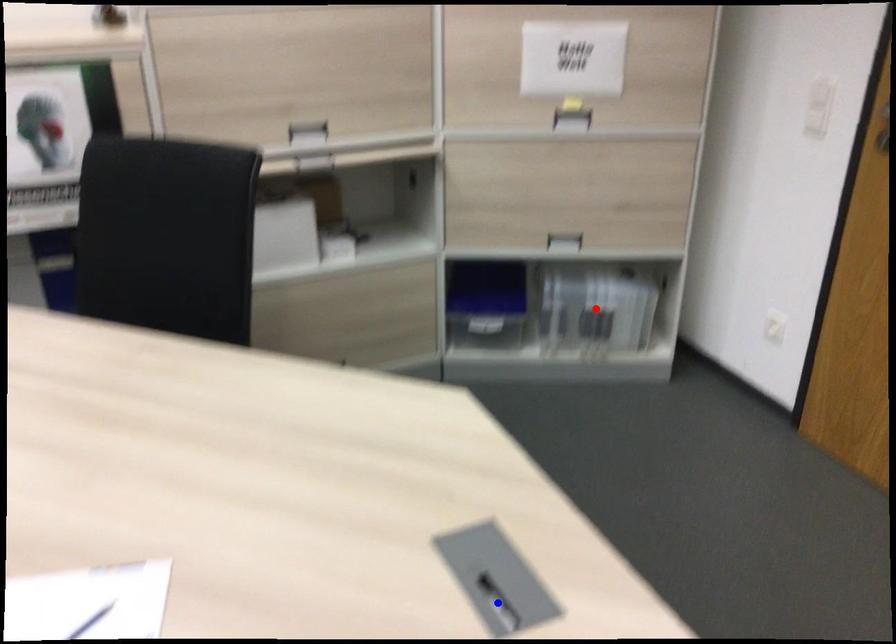
Question: Two points are marked on the image. Which point is closer to the camera?

Choices:
 (A) Blue point is closer.
 (B) Red point is closer.

Answer: (A)